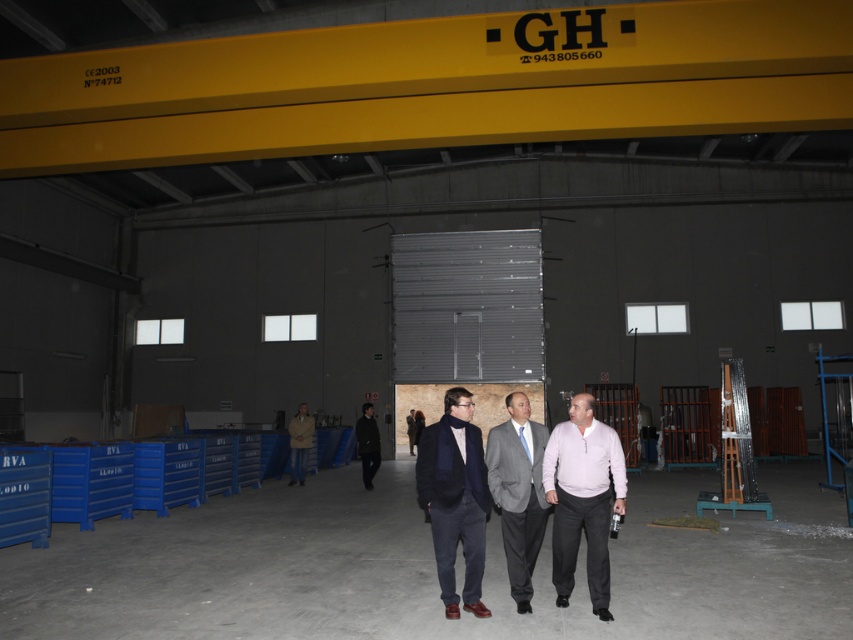
Question: Estimate the real-world distances between objects in this image. Which object is closer to the blue silk tie at center?

Choices:
 (A) dark blue wool coat at center
 (B) light brown leather jacket at center
 (C) pink matte sweater at center

Answer: (C)

Question: Considering the real-world distances, which object is closest to the dark brown leather jacket at center?

Choices:
 (A) light brown leather jacket at center
 (B) blue silk tie at center
 (C) pink matte sweater at center
 (D) dark blue wool coat at center

Answer: (A)

Question: Is pink matte sweater at center positioned at the back of blue silk tie at center?

Choices:
 (A) yes
 (B) no

Answer: (B)

Question: Based on their relative distances, which object is nearer to the dark blue wool coat at center?

Choices:
 (A) dark brown leather jacket at center
 (B) gray suit at center
 (C) light brown leather jacket at center

Answer: (B)

Question: Can you confirm if pink matte sweater at center is positioned to the left of gray suit at center?

Choices:
 (A) yes
 (B) no

Answer: (B)

Question: Can you confirm if pink matte sweater at center is positioned below dark blue wool coat at center?

Choices:
 (A) yes
 (B) no

Answer: (B)